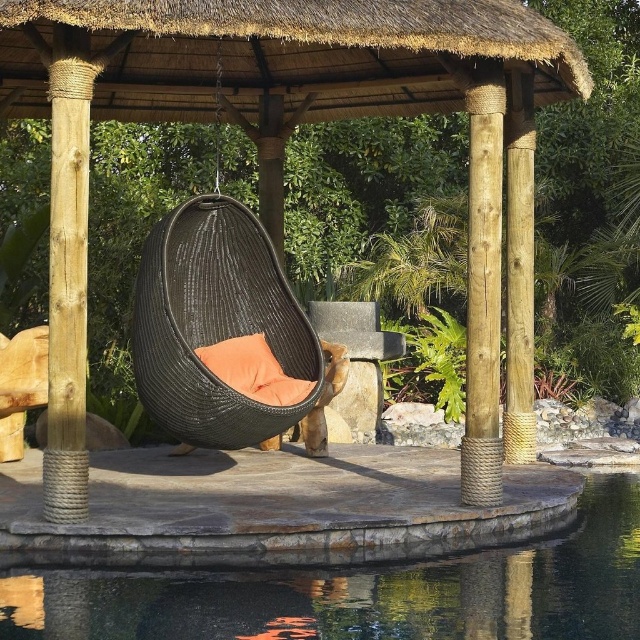
You are standing in front of the wooden gazebo with the egg chair. There are two points marked on the gazebo structure. Which point is closer to you, point [561,630] or point [520,424]?

Point [561,630] is closer to the camera than point [520,424].